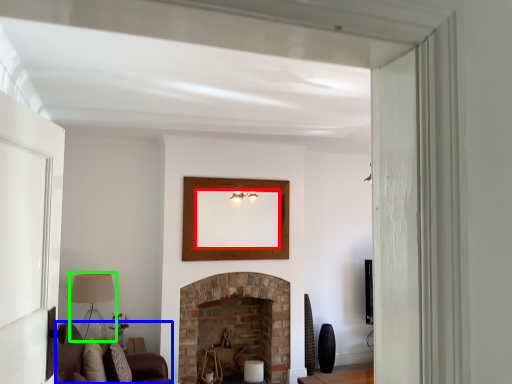
Question: Which object is the closest to the mirror (highlighted by a red box)? Choose among these: couch (highlighted by a blue box) or lamp (highlighted by a green box).

Choices:
 (A) couch
 (B) lamp

Answer: (B)